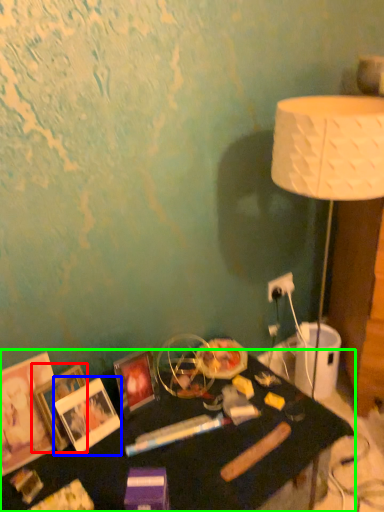
Question: Based on their relative distances, which object is farther from picture frame (highlighted by a red box)? Choose from picture frame (highlighted by a blue box) and table (highlighted by a green box).

Choices:
 (A) picture frame
 (B) table

Answer: (B)